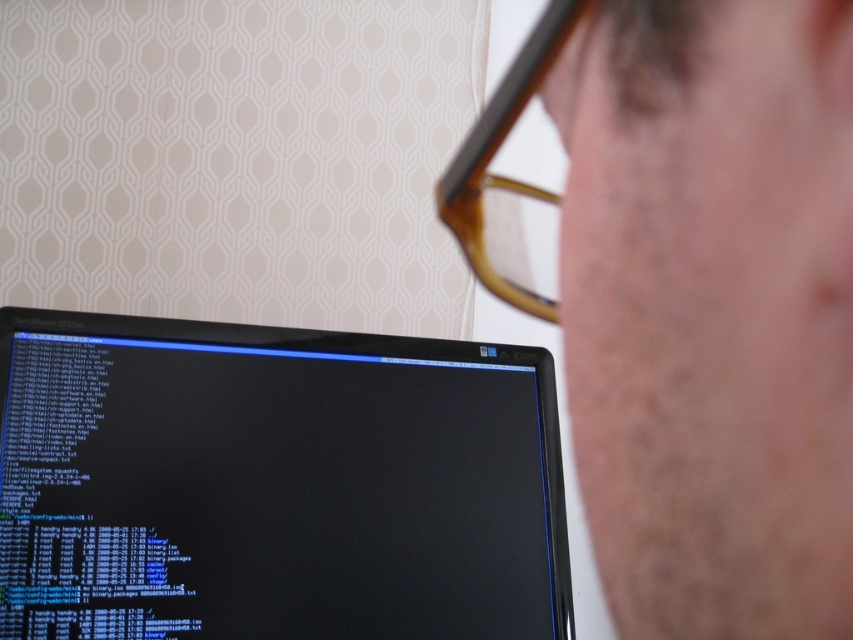
You are a photographer adjusting your camera settings to capture the scene. You notice the matte skin at center and the brown tortoiseshell glasses at upper center. Which object should you focus on if you want to ensure the larger one is in sharp focus?

The matte skin at center is bigger than the brown tortoiseshell glasses at upper center, so you should focus on the matte skin at center to ensure the larger object is in sharp focus.

Based on the photo, you are a photographer setting up a portrait shoot. You notice the matte skin at center and the black glossy monitor at center in the frame. Which object should you adjust to avoid reflections from interfering with the subject?

The black glossy monitor at center should be adjusted because it has a glossy surface that can cause reflections, whereas the matte skin at center does not reflect light as much.

You are a photographer setting up a portrait shoot in this scene. You want to position a spotlight so that it illuminates the matte skin at center without reflecting off the black glossy monitor at center. Based on their positions, which side of the monitor should you place the spotlight?

The matte skin at center is to the right of the black glossy monitor at center. To avoid reflection on the monitor, place the spotlight to the right side of the monitor so the light hits the skin directly but doesn